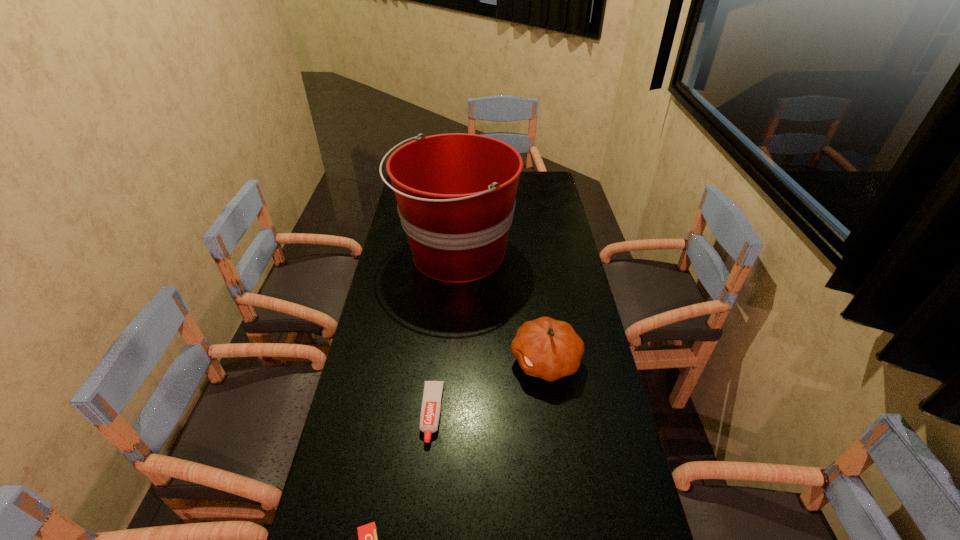
This screenshot has height=540, width=960. Identify the location of the tallest object. (455, 192).

This screenshot has width=960, height=540. What are the coordinates of `bucket` in the screenshot? It's located at (455, 192).

Identify the location of the third shortest object. (550, 349).

Locate an element on the screen. the third tallest object is located at coordinates (431, 403).

Identify the location of the farther toothpaste. Image resolution: width=960 pixels, height=540 pixels. (431, 403).

Locate an element on the screen. free space located on the back of the tallest object is located at coordinates (461, 178).

Where is `blank area located on the front face of the second tallest object`? blank area located on the front face of the second tallest object is located at coordinates (420, 361).

You are a GUI agent. You are given a task and a screenshot of the screen. Output one action in this format:
    pyautogui.click(x=<x>, y=<y>)
    Task: Click on the vacant region located on the front face of the second tallest object
    The height and width of the screenshot is (540, 960).
    Given the screenshot: What is the action you would take?
    pyautogui.click(x=390, y=361)

This screenshot has width=960, height=540. I want to click on vacant space situated 0.100m on the front face of the second tallest object, so click(x=476, y=361).

You are a GUI agent. You are given a task and a screenshot of the screen. Output one action in this format:
    pyautogui.click(x=<x>, y=<y>)
    Task: Click on the free spot located 0.110m on the back of the second shortest object
    
    Given the screenshot: What is the action you would take?
    pyautogui.click(x=438, y=355)